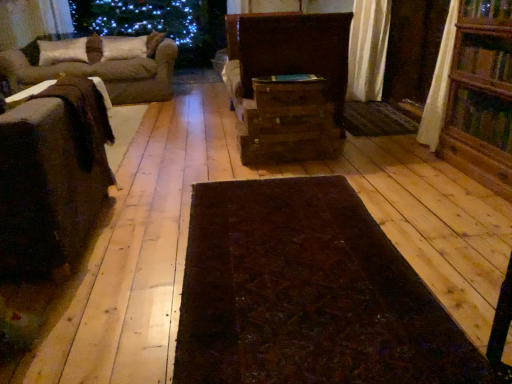
The image size is (512, 384). What are the coordinates of `vacant space in between wooden bookshelf at right and brown wooden drawer at center, the first drawer positioned from the bottom` in the screenshot? It's located at (379, 168).